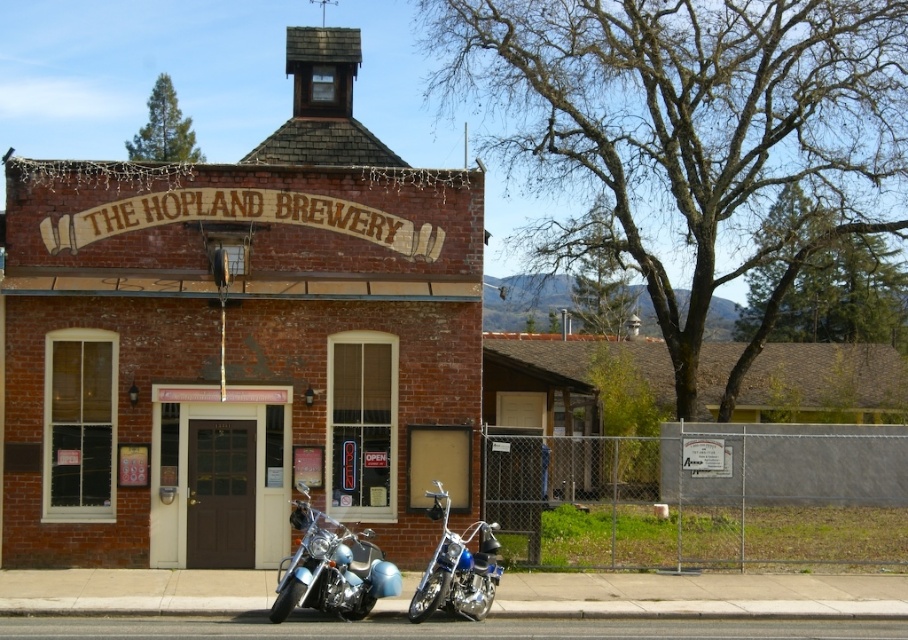
You are a delivery person trying to park your shiny chrome motorcycle at center in front of the brown wooden door at center. Can the motorcycle fit in front of the door without overlapping?

The brown wooden door at center is wider than the shiny chrome motorcycle at center, so the motorcycle can fit in front of the door without overlapping.